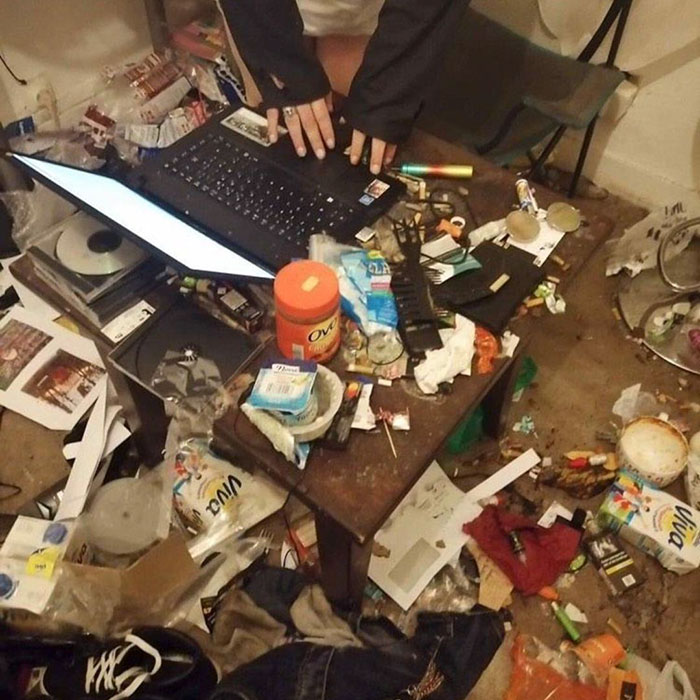
Locate an element on the screen. garbage on the floor is located at coordinates (522, 374), (525, 419), (610, 526), (589, 469), (570, 678), (663, 509), (635, 257), (554, 290).